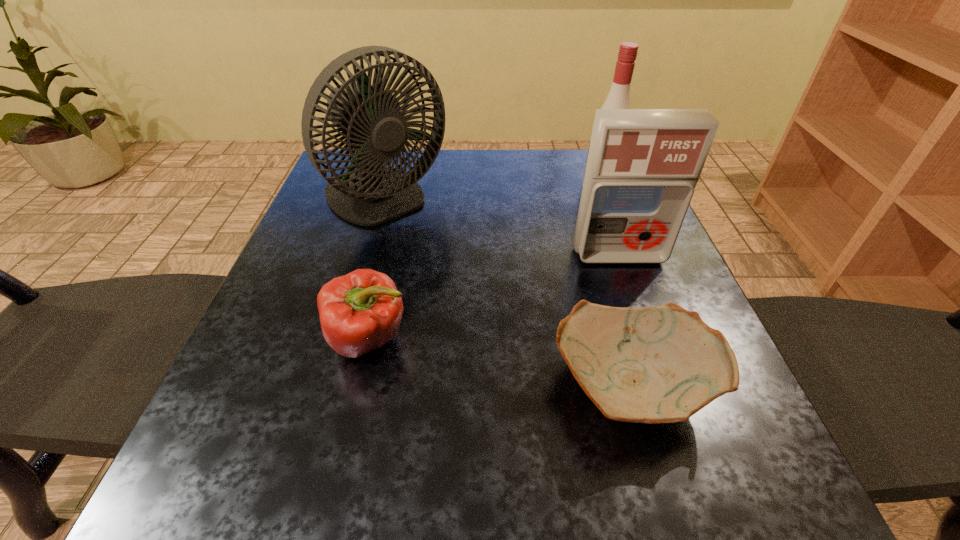
Locate an element on the screen. This screenshot has height=540, width=960. fan is located at coordinates (370, 117).

This screenshot has width=960, height=540. Identify the location of alcohol. (618, 97).

Locate an element on the screen. the first-aid kit is located at coordinates (643, 165).

You are a GUI agent. You are given a task and a screenshot of the screen. Output one action in this format:
    pyautogui.click(x=<x>, y=<y>)
    Task: Click on the bell pepper
    The image size is (960, 540).
    Given the screenshot: What is the action you would take?
    pyautogui.click(x=361, y=311)

You are a GUI agent. You are given a task and a screenshot of the screen. Output one action in this format:
    pyautogui.click(x=<x>, y=<y>)
    Task: Click on the shortest object
    This screenshot has width=960, height=540.
    Given the screenshot: What is the action you would take?
    pyautogui.click(x=659, y=364)

The image size is (960, 540). Find the location of `free space located 0.070m in front of the fan to direct airflow`. free space located 0.070m in front of the fan to direct airflow is located at coordinates (368, 264).

I want to click on free space located 0.170m on the label of the alcohol, so click(x=512, y=188).

Find the location of a particular element. This screenshot has height=540, width=960. free space located 0.390m on the label of the alcohol is located at coordinates (420, 188).

Find the location of `blank space located 0.240m on the label of the alcohol`. blank space located 0.240m on the label of the alcohol is located at coordinates (483, 188).

This screenshot has height=540, width=960. In order to click on free location located on the front-facing side of the third farthest object in this screenshot , I will do `click(642, 320)`.